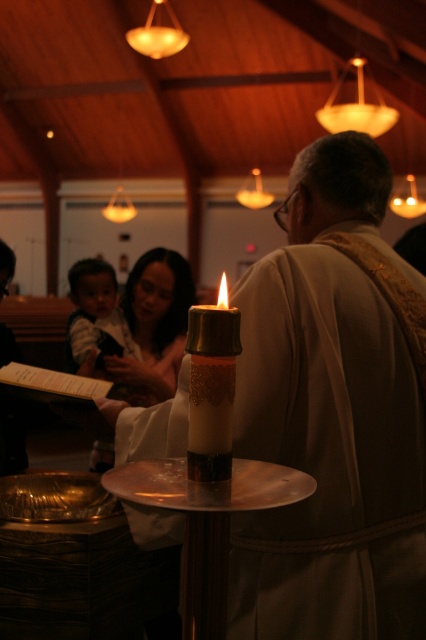
Which is in front, point (278, 328) or point (210, 339)?

Point (210, 339) is more forward.

Which is behind, point (316, 419) or point (218, 348)?

The point (316, 419) is behind.

Identify the location of matte gold robe at center. (331, 413).